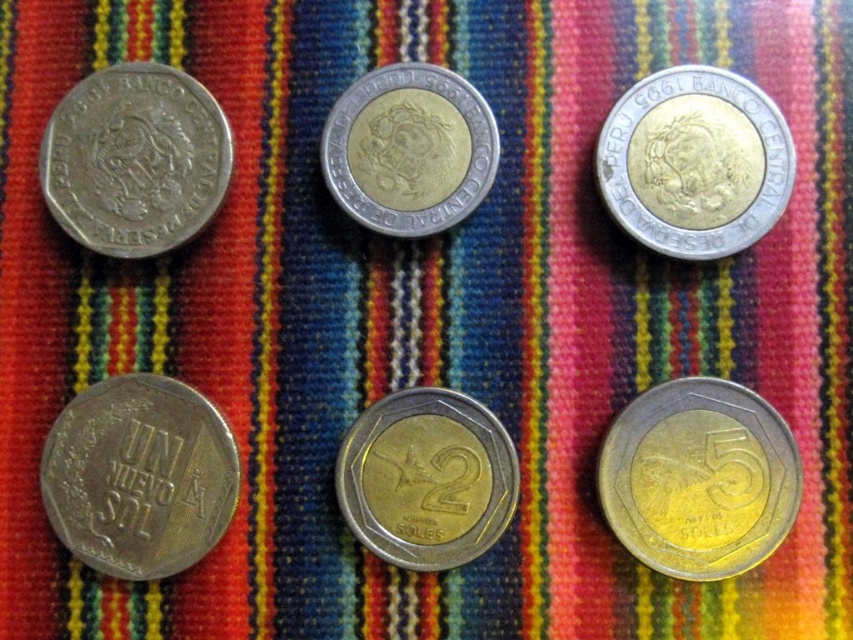
Which coin is located at the coordinate point [699,477]?

The gold_plated metal coin at bottom right is located at point [699,477].